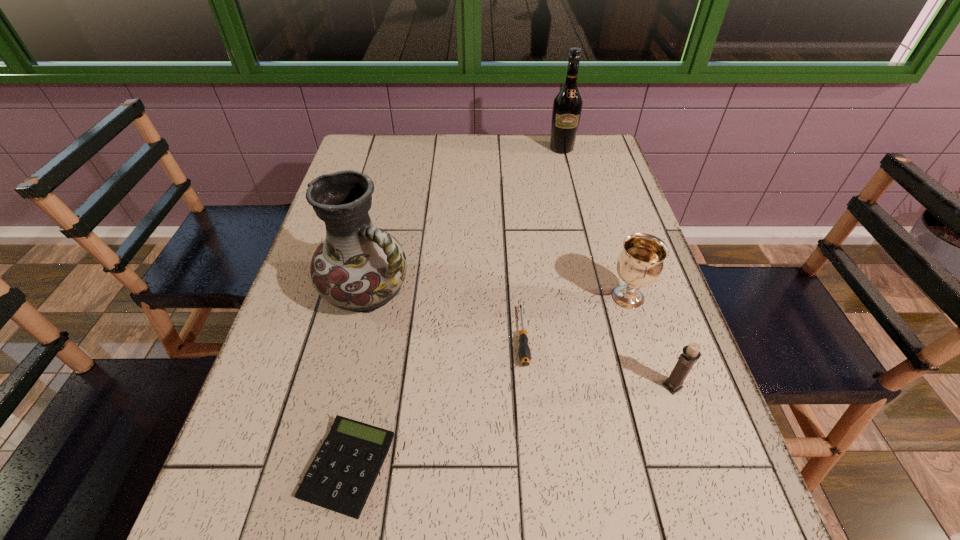
Where is `object present at the far right corner`? This screenshot has width=960, height=540. object present at the far right corner is located at coordinates (567, 107).

Identify the location of vacant space at the far edge of the desktop. (441, 160).

The height and width of the screenshot is (540, 960). In order to click on vacant space at the left edge of the desktop in this screenshot , I will do [x=285, y=347].

The width and height of the screenshot is (960, 540). I want to click on free spot at the right edge of the desktop, so click(743, 499).

The height and width of the screenshot is (540, 960). In order to click on vacant area at the far left corner of the desktop in this screenshot , I will do `click(396, 163)`.

In order to click on unoccupied area between the screwdriver and the chalice in this screenshot , I will do `click(575, 317)`.

Identify the location of vacant space in between the fifth tallest object and the shortest object. (435, 401).

You are a GUI agent. You are given a task and a screenshot of the screen. Output one action in this format:
    pyautogui.click(x=<x>, y=<y>)
    Task: Click on the vacant space that is in between the vase and the calculator
    This screenshot has width=960, height=540.
    Given the screenshot: What is the action you would take?
    pyautogui.click(x=358, y=379)

Image resolution: width=960 pixels, height=540 pixels. What are the coordinates of `vacant space that is in between the vase and the chalice` in the screenshot? It's located at (498, 294).

Locate an element on the screen. free space between the chalice and the fifth tallest object is located at coordinates (575, 317).